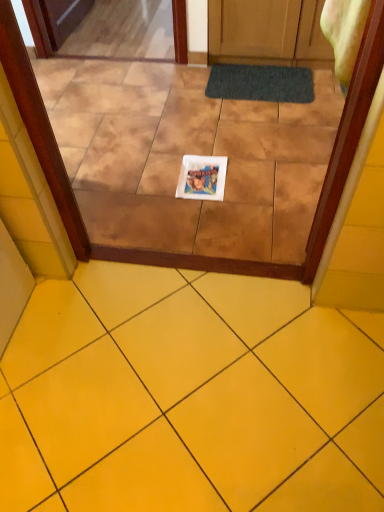
Measure the distance between point (29, 86) and camera.

The distance of point (29, 86) from camera is 1.10 meters.

The height and width of the screenshot is (512, 384). In order to click on transparent glass door at center in this screenshot , I will do `click(325, 176)`.

What do you see at coordinates (189, 396) in the screenshot? This screenshot has height=512, width=384. I see `yellow ceramic tile at lower center` at bounding box center [189, 396].

From the picture: What is the approximate height of dark gray textured bath mat at center?

It is 1.16 inches.

At what (x,y) coordinates should I click in order to perform the action: click on dark gray textured bath mat at center. Please return your answer as a coordinate pair (x, y). This screenshot has height=512, width=384. Looking at the image, I should click on (261, 83).

This screenshot has height=512, width=384. What are the coordinates of `transparent glass door at center` in the screenshot? It's located at (325, 176).

Considering the relative sizes of dark gray textured bath mat at center and yellow ceramic tile at lower center in the image provided, is dark gray textured bath mat at center taller than yellow ceramic tile at lower center?

No.

Does dark gray textured bath mat at center come in front of yellow ceramic tile at lower center?

No, it is not.

Is dark gray textured bath mat at center at the right side of yellow ceramic tile at lower center?

Yes.

Between dark gray textured bath mat at center and yellow ceramic tile at lower center, which one has larger size?

yellow ceramic tile at lower center.

Is white paper at center at the right side of yellow ceramic tile at lower center?

Yes, white paper at center is to the right of yellow ceramic tile at lower center.

Looking at this image, considering the sizes of objects white paper at center and yellow ceramic tile at lower center in the image provided, who is wider, white paper at center or yellow ceramic tile at lower center?

yellow ceramic tile at lower center is wider.

From a real-world perspective, which object stands above the other?

yellow ceramic tile at lower center is physically above.

Can you tell me how much dark gray textured bath mat at center and transparent glass door at center differ in facing direction?

They differ by 180 degrees in their facing directions.

Considering the relative positions of dark gray textured bath mat at center and transparent glass door at center in the image provided, is dark gray textured bath mat at center to the left or to the right of transparent glass door at center?

Based on their positions, dark gray textured bath mat at center is located to the right of transparent glass door at center.

Would you consider dark gray textured bath mat at center to be distant from transparent glass door at center?

Absolutely, dark gray textured bath mat at center is distant from transparent glass door at center.

Is yellow ceramic tile at lower center behind dark gray textured bath mat at center?

No.

From the picture: Can you confirm if yellow ceramic tile at lower center is bigger than dark gray textured bath mat at center?

Correct, yellow ceramic tile at lower center is larger in size than dark gray textured bath mat at center.

From a real-world perspective, is yellow ceramic tile at lower center on top of dark gray textured bath mat at center?

Yes.

Between yellow ceramic tile at lower center and dark gray textured bath mat at center, which one has less height?

dark gray textured bath mat at center.

Locate an element on the screen. Image resolution: width=384 pixels, height=512 pixels. glass door on the left of yellow ceramic tile at lower center is located at coordinates (325, 176).

Looking at this image, from a real-world perspective, is yellow ceramic tile at lower center physically located above or below transparent glass door at center?

From a real-world perspective, yellow ceramic tile at lower center is physically above transparent glass door at center.

Can you confirm if yellow ceramic tile at lower center is wider than transparent glass door at center?

In fact, yellow ceramic tile at lower center might be narrower than transparent glass door at center.

Can you confirm if yellow ceramic tile at lower center is positioned to the left of transparent glass door at center?

→ No, yellow ceramic tile at lower center is not to the left of transparent glass door at center.

From a real-world perspective, does transparent glass door at center stand above yellow ceramic tile at lower center?

No, from a real-world perspective, transparent glass door at center is not over yellow ceramic tile at lower center

In terms of height, does transparent glass door at center look taller or shorter compared to yellow ceramic tile at lower center?

Considering their sizes, transparent glass door at center has more height than yellow ceramic tile at lower center.

Consider the image. From the image's perspective, is transparent glass door at center on top of yellow ceramic tile at lower center?

Indeed, from the image's perspective, transparent glass door at center is shown above yellow ceramic tile at lower center.

Is transparent glass door at center located outside yellow ceramic tile at lower center?

transparent glass door at center lies outside yellow ceramic tile at lower center's area.

Which is more to the left, white paper at center or dark gray textured bath mat at center?

From the viewer's perspective, white paper at center appears more on the left side.

From the image's perspective, which is below, white paper at center or dark gray textured bath mat at center?

From the image's view, white paper at center is below.

Can you confirm if white paper at center is thinner than dark gray textured bath mat at center?

Yes.

Is white paper at center oriented away from dark gray textured bath mat at center?

Yes.

The width and height of the screenshot is (384, 512). Find the location of `bath mat lying above the yellow ceramic tile at lower center (from the image's perspective)`. bath mat lying above the yellow ceramic tile at lower center (from the image's perspective) is located at coordinates (261, 83).

This screenshot has width=384, height=512. Identify the location of ceramic tile located above the white paper at center (from a real-world perspective). (189, 396).

Considering their positions, is transparent glass door at center positioned closer to white paper at center than yellow ceramic tile at lower center?

transparent glass door at center is positioned closer to the anchor white paper at center.

Estimate the real-world distances between objects in this image. Which object is closer to dark gray textured bath mat at center, yellow ceramic tile at lower center or transparent glass door at center?

Based on the image, transparent glass door at center appears to be nearer to dark gray textured bath mat at center.

Based on their spatial positions, is dark gray textured bath mat at center or transparent glass door at center closer to white paper at center?

Based on the image, transparent glass door at center appears to be nearer to white paper at center.

Based on their spatial positions, is white paper at center or dark gray textured bath mat at center further from transparent glass door at center?

dark gray textured bath mat at center is positioned further to the anchor transparent glass door at center.

Estimate the real-world distances between objects in this image. Which object is further from dark gray textured bath mat at center, transparent glass door at center or yellow ceramic tile at lower center?

Among the two, yellow ceramic tile at lower center is located further to dark gray textured bath mat at center.

Looking at the image, which one is located further to dark gray textured bath mat at center, transparent glass door at center or white paper at center?

Based on the image, transparent glass door at center appears to be further to dark gray textured bath mat at center.

Looking at the image, which one is located further to dark gray textured bath mat at center, yellow ceramic tile at lower center or white paper at center?

The object further to dark gray textured bath mat at center is yellow ceramic tile at lower center.

In the scene shown: When comparing their distances from yellow ceramic tile at lower center, does transparent glass door at center or dark gray textured bath mat at center seem closer?

Among the two, transparent glass door at center is located nearer to yellow ceramic tile at lower center.

Identify the location of copy between dark gray textured bath mat at center and yellow ceramic tile at lower center in the up-down direction. (202, 178).

Where is `glass door between dark gray textured bath mat at center and yellow ceramic tile at lower center in the vertical direction`? glass door between dark gray textured bath mat at center and yellow ceramic tile at lower center in the vertical direction is located at coordinates (325, 176).

Locate an element on the screen. The image size is (384, 512). copy between transparent glass door at center and yellow ceramic tile at lower center from top to bottom is located at coordinates (202, 178).

Identify the location of copy between transparent glass door at center and dark gray textured bath mat at center from front to back. (202, 178).